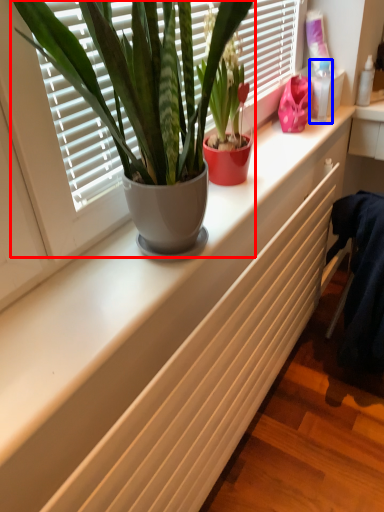
Question: Which point is closer to the camera, houseplant (highlighted by a red box) or toiletry (highlighted by a blue box)?

Choices:
 (A) houseplant
 (B) toiletry

Answer: (A)